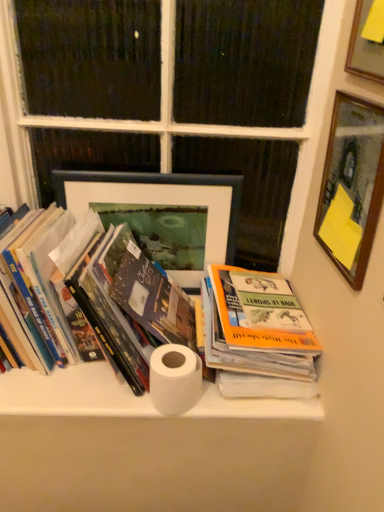
Question: From the image's perspective, is matte black picture frame at center, which is counted as the first picture frame, starting from the back, below wooden picture frame at upper right, which is the second picture frame from front to back?

Choices:
 (A) no
 (B) yes

Answer: (B)

Question: From the image's perspective, would you say matte black picture frame at center, which is counted as the first picture frame, starting from the back, is positioned over wooden picture frame at upper right, which is the second picture frame from front to back?

Choices:
 (A) no
 (B) yes

Answer: (A)

Question: Is matte black picture frame at center, the first picture frame in the left-to-right sequence, in front of wooden picture frame at upper right, which is the second picture frame from front to back?

Choices:
 (A) yes
 (B) no

Answer: (B)

Question: Is matte black picture frame at center, positioned as the 3th picture frame in front-to-back order, positioned far away from wooden picture frame at upper right, acting as the second picture frame starting from the right?

Choices:
 (A) no
 (B) yes

Answer: (A)

Question: Considering the relative sizes of matte black picture frame at center, the third picture frame when ordered from right to left, and wooden picture frame at upper right, which is the second picture frame from front to back, in the image provided, is matte black picture frame at center, the third picture frame when ordered from right to left, bigger than wooden picture frame at upper right, which is the second picture frame from front to back,?

Choices:
 (A) no
 (B) yes

Answer: (B)

Question: In terms of height, does wooden picture frame at upper right, which is the second picture frame from front to back, look taller or shorter compared to matte black picture frame at center, positioned as the 3th picture frame in front-to-back order?

Choices:
 (A) short
 (B) tall

Answer: (A)

Question: From a real-world perspective, is wooden picture frame at upper right, which is the 2th picture frame from back to front, positioned above or below matte black picture frame at center, positioned as the 3th picture frame in front-to-back order?

Choices:
 (A) below
 (B) above

Answer: (B)

Question: From the image's perspective, is wooden picture frame at upper right, which is the 2th picture frame from back to front, above or below matte black picture frame at center, positioned as the 3th picture frame in front-to-back order?

Choices:
 (A) above
 (B) below

Answer: (A)

Question: Considering the positions of point (360, 279) and point (153, 232), is point (360, 279) closer or farther from the camera than point (153, 232)?

Choices:
 (A) farther
 (B) closer

Answer: (B)

Question: Considering their positions, is matte black picture frame at center, the first picture frame in the left-to-right sequence, located in front of or behind white painted wood at upper center?

Choices:
 (A) behind
 (B) front

Answer: (A)

Question: Is matte black picture frame at center, which is counted as the first picture frame, starting from the back, taller or shorter than white painted wood at upper center?

Choices:
 (A) short
 (B) tall

Answer: (A)

Question: From the image's perspective, relative to white painted wood at upper center, is matte black picture frame at center, which is counted as the first picture frame, starting from the back, above or below?

Choices:
 (A) above
 (B) below

Answer: (B)

Question: Do you think matte black picture frame at center, the first picture frame in the left-to-right sequence, is within white painted wood at upper center, or outside of it?

Choices:
 (A) inside
 (B) outside

Answer: (A)

Question: Considering the positions of white matte toilet paper at center and hardcover book at left, which ranks as the first book in left-to-right order, in the image, is white matte toilet paper at center wider or thinner than hardcover book at left, which ranks as the first book in left-to-right order,?

Choices:
 (A) wide
 (B) thin

Answer: (B)

Question: From the image's perspective, is white matte toilet paper at center located above or below hardcover book at left, the second book from the right?

Choices:
 (A) above
 (B) below

Answer: (B)